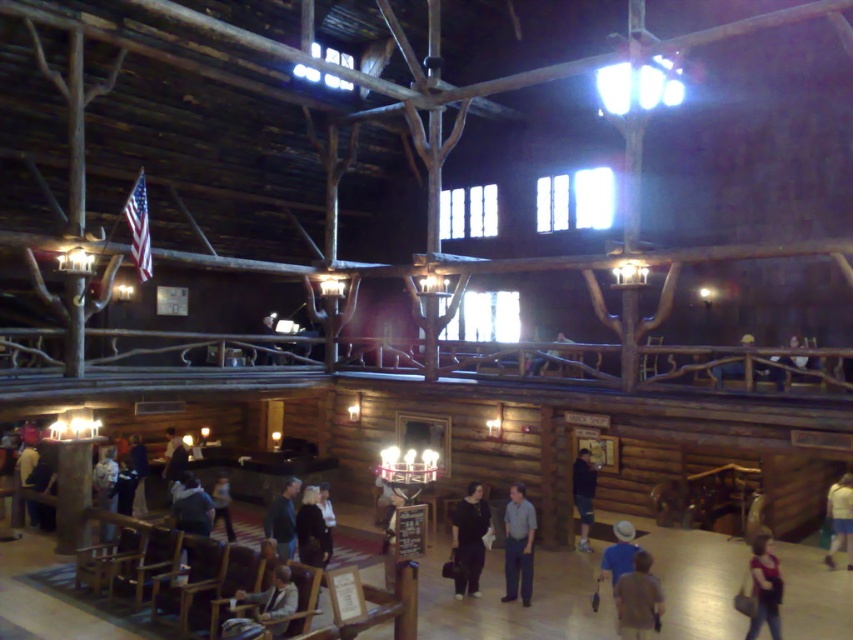
You are standing in the rustic wooden lodge and want to know if the light brown shirt at lower right is positioned higher than the light brown wooden chair at lower left. Can you confirm this based on their placement?

Yes, the light brown shirt at lower right is located above the light brown wooden chair at lower left, so it is positioned higher.

You are standing at the entrance of the rustic wooden lodge and see the light brown wooden chair at lower left represented by point (273, 600). Can you walk straight ahead from the entrance to reach the chair?

The light brown wooden chair at lower left is represented by point (273, 600). Since the coordinates indicate its position relative to the entrance, walking straight ahead might not be the correct path. You may need to adjust your direction based on the chair location marked by the point.